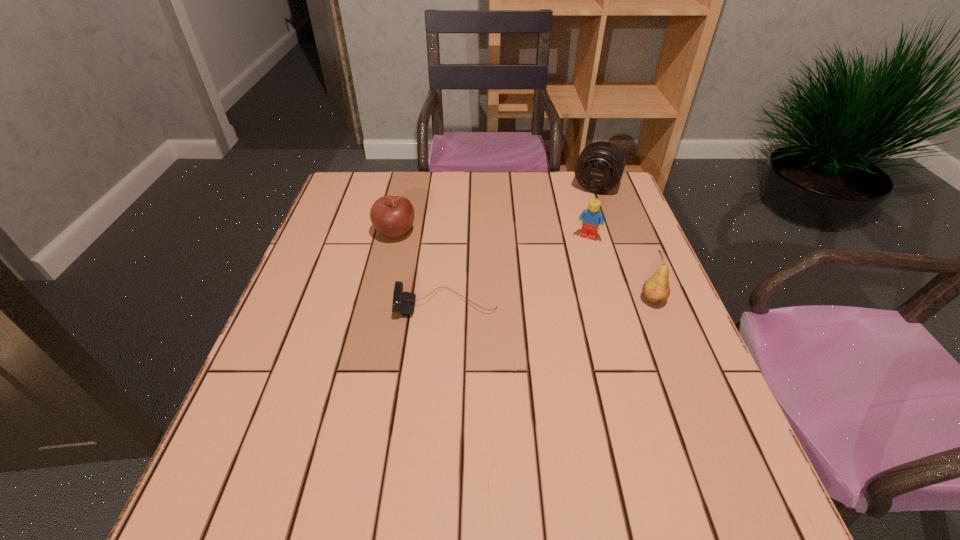
Find the location of a particular element. This screenshot has height=540, width=960. free space between the pear and the Lego is located at coordinates (620, 269).

I want to click on the third closest object to the telephoto lens, so click(404, 302).

Locate which object is the fourth closest to the fourth tallest object. Please provide its 2D coordinates. Your answer should be formatted as a tuple, i.e. [(x, y)], where the tuple contains the x and y coordinates of a point satisfying the conditions above.

[(656, 290)]

What are the coordinates of `free space in the image that satisfies the following two spatial constraints: 1. on the front side of the second shortest object; 2. on the right side of the pear` in the screenshot? It's located at (380, 300).

Identify the location of free point that satisfies the following two spatial constraints: 1. on the front side of the webcam; 2. on the front-facing side of the apple. (379, 305).

In order to click on vacant space that satisfies the following two spatial constraints: 1. on the front side of the shortest object; 2. on the front-facing side of the apple in this screenshot , I will do `click(379, 305)`.